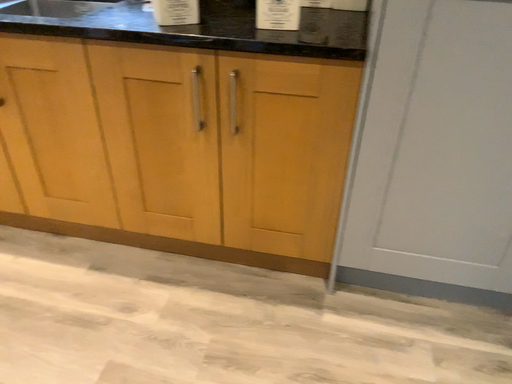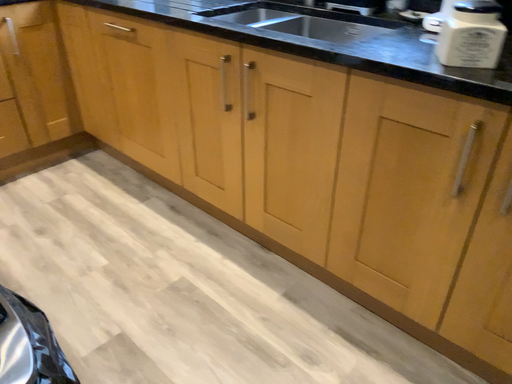
Question: How did the camera likely rotate when shooting the video?

Choices:
 (A) rotated right
 (B) rotated left

Answer: (B)